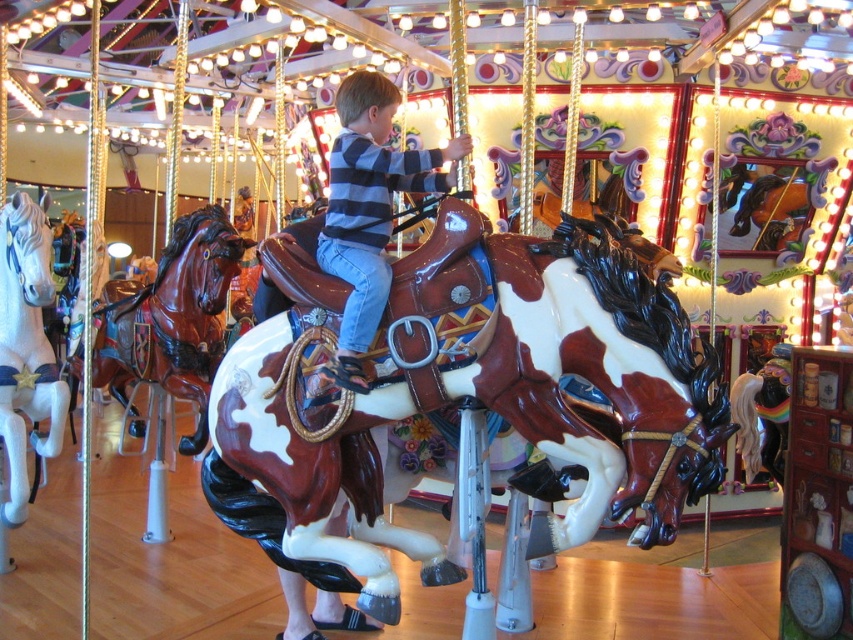
You are a photographer trying to capture a clear shot of the striped cotton shirt at center and the white glossy horse at left. The camera lens has a maximum width of 1 meter. Can both objects fit within the frame without overlapping?

The striped cotton shirt at center might be wider than white glossy horse at left, so there is a possibility that the total width of both objects exceeds the camera lens maximum width of 1 meter. It depends on their exact dimensions.

You are standing in front of the carousel and want to take a photo. You notice two points on the carousel, point 1 at position point (607, 260) and point 2 at position point (132, 340). Which point will appear larger in your photo?

Point 1 at position point (607, 260) will appear larger in the photo because it is closer to the camera than point 2 at position point (132, 340).

You are a photographer standing in front of the carousel. You want to take a photo that includes both the striped cotton shirt at center and the white glossy horse at left. Based on their positions, which object should be placed to the right in your photo?

The striped cotton shirt at center is positioned on the right side of the white glossy horse at left, so in the photo, the striped cotton shirt at center should be placed to the right of the white glossy horse at left.